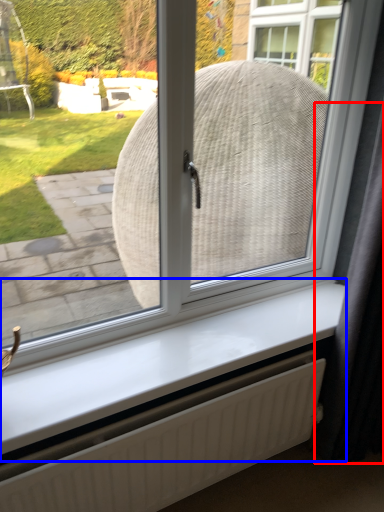
Question: Which object is closer to the camera taking this photo, curtain (highlighted by a red box) or window sill (highlighted by a blue box)?

Choices:
 (A) curtain
 (B) window sill

Answer: (A)